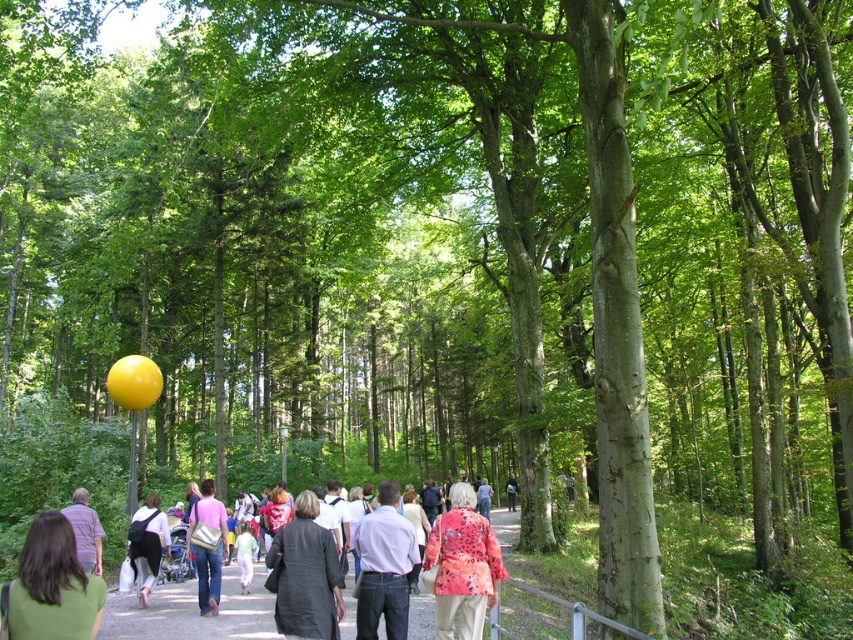
Question: Which point is closer to the camera?

Choices:
 (A) yellow rubber balloon at center
 (B) floral fabric jacket at center
 (C) light blue shirt at center
 (D) pink fabric bag at center

Answer: (C)

Question: Does smooth asphalt path at center have a lesser width compared to dark gray suit at center?

Choices:
 (A) no
 (B) yes

Answer: (A)

Question: Which point is farther from the camera taking this photo?

Choices:
 (A) (225, 620)
 (B) (160, 544)
 (C) (364, 589)

Answer: (B)

Question: Can you confirm if pink fabric bag at center is positioned below black fabric backpack at center?

Choices:
 (A) yes
 (B) no

Answer: (A)

Question: Among these objects, which one is farthest from the camera?

Choices:
 (A) floral fabric jacket at center
 (B) matte purple shirt at center

Answer: (A)

Question: Does black fabric backpack at center appear on the left side of light pink fabric pants at center?

Choices:
 (A) yes
 (B) no

Answer: (A)